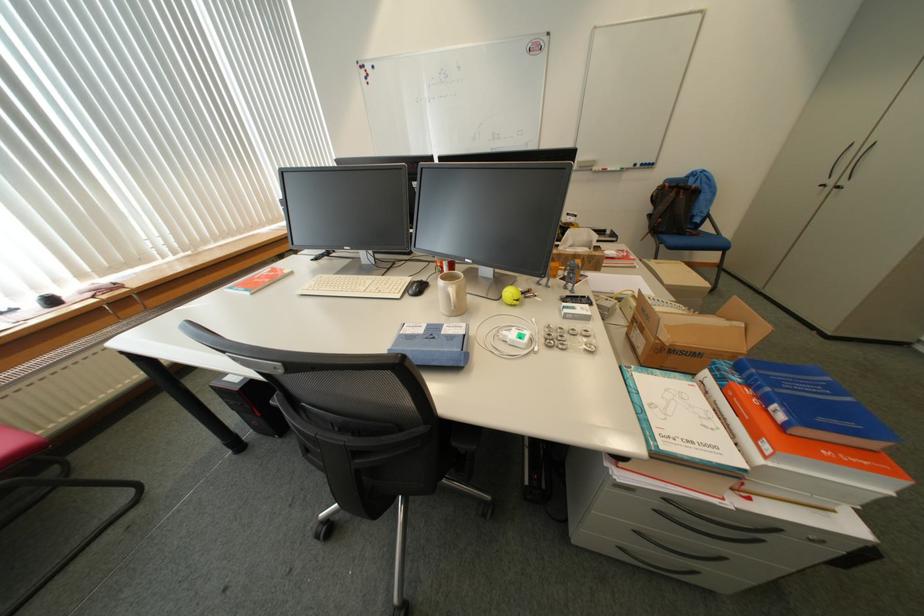
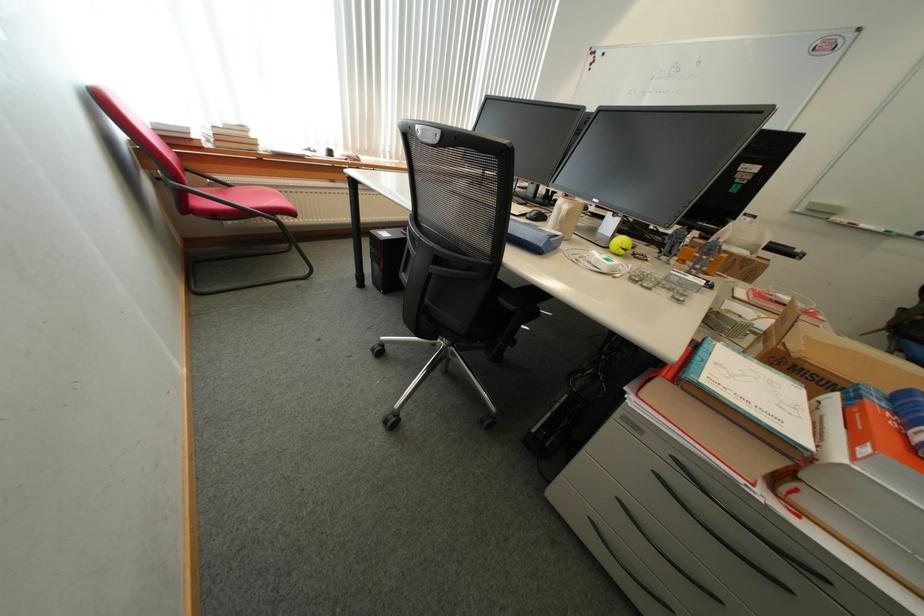
Locate, in the second image, the point that corresponds to the point at 465,309 in the first image.

(570, 223)